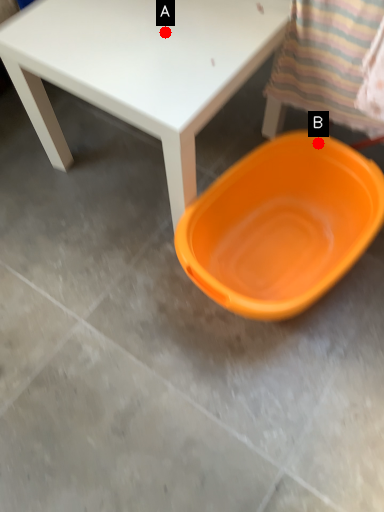
Question: Two points are circled on the image, labeled by A and B beside each circle. Which point is farther from the camera taking this photo?

Choices:
 (A) A is further
 (B) B is further

Answer: (B)